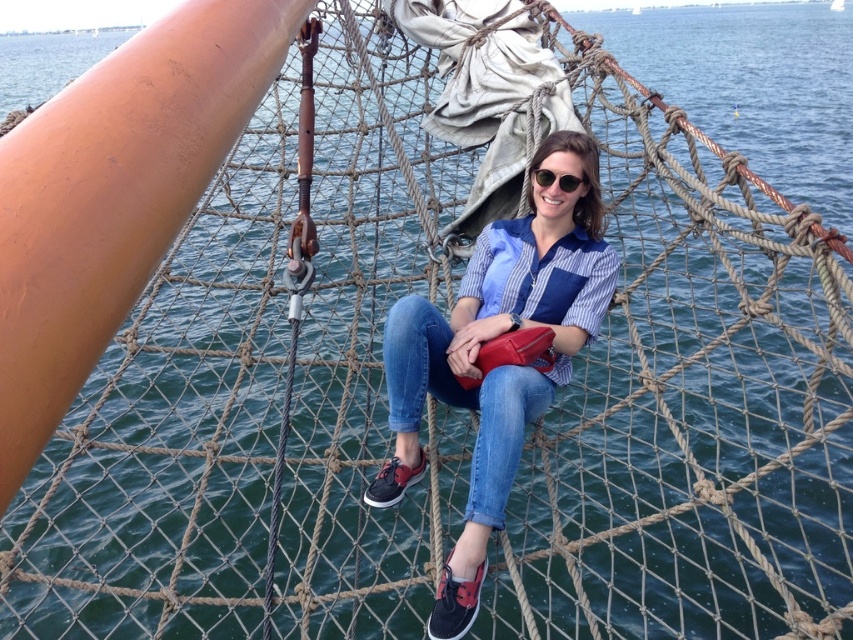
Question: Which of the following is the closest to the observer?

Choices:
 (A) (563, 188)
 (B) (463, 598)

Answer: (B)

Question: Can you confirm if blue denim jeans at center is thinner than sunglasses at center?

Choices:
 (A) yes
 (B) no

Answer: (B)

Question: Which object is farther from the camera taking this photo?

Choices:
 (A) blue denim jeans at center
 (B) sunglasses at center

Answer: (B)

Question: Considering the relative positions of blue denim jeans at center and sunglasses at center in the image provided, where is blue denim jeans at center located with respect to sunglasses at center?

Choices:
 (A) above
 (B) below

Answer: (B)

Question: Can you confirm if blue denim jeans at center is positioned to the right of sunglasses at center?

Choices:
 (A) yes
 (B) no

Answer: (B)